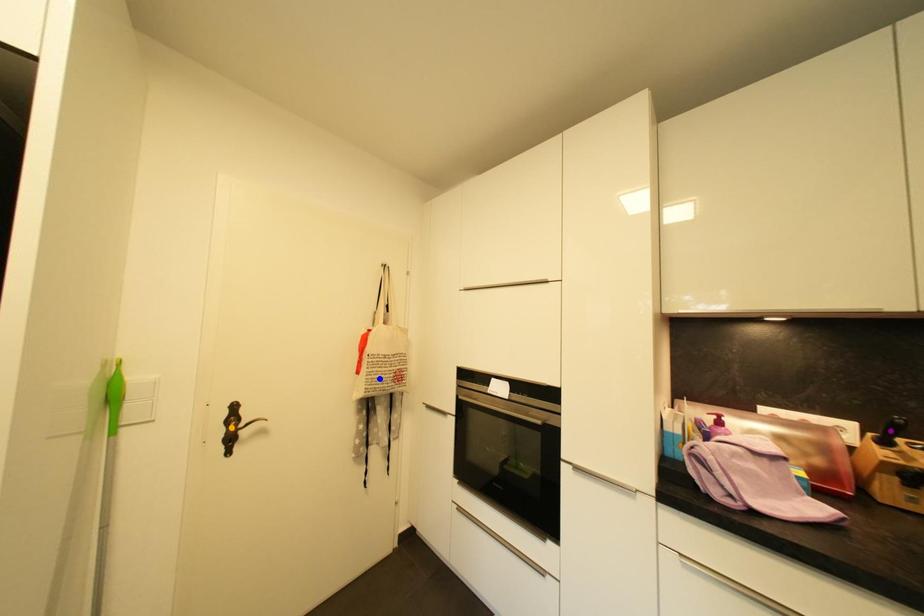
Order these from nearest to farthest:
blue point | orange point | purple point

purple point < orange point < blue point